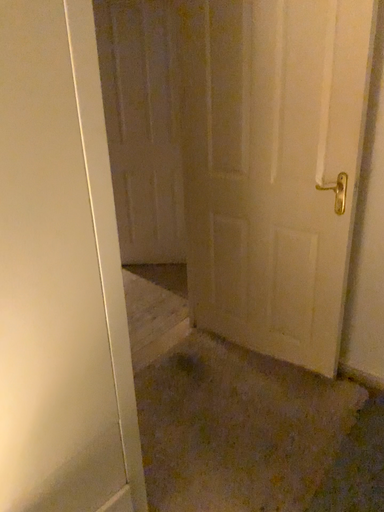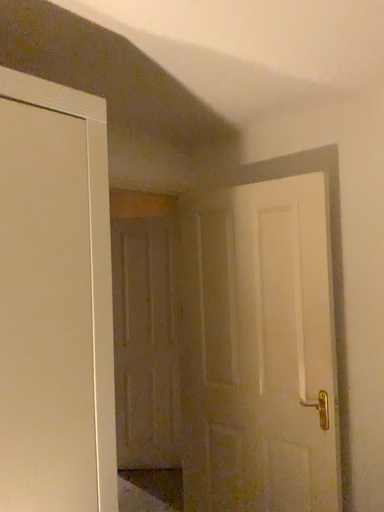
Question: Which way did the camera rotate in the video?

Choices:
 (A) rotated downward
 (B) rotated upward

Answer: (B)